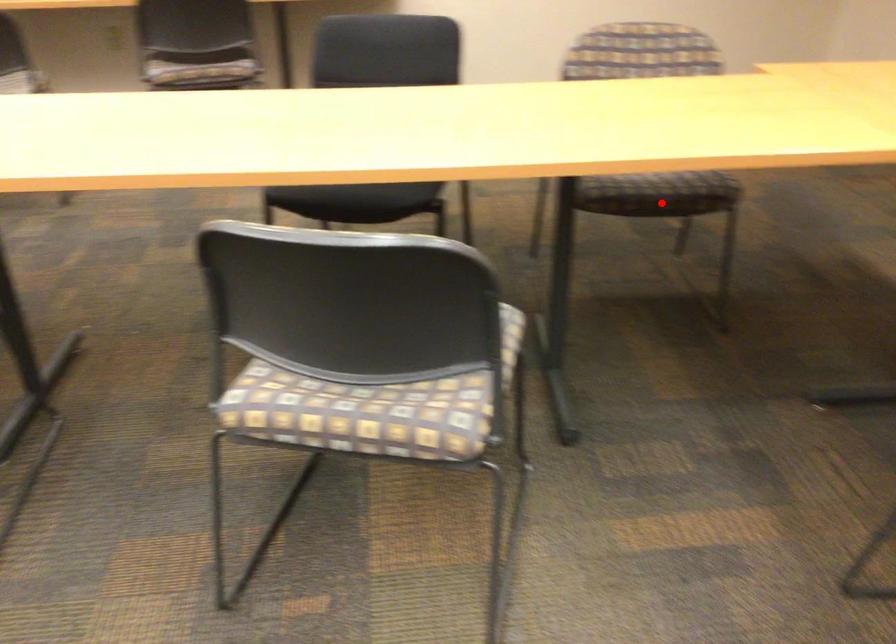
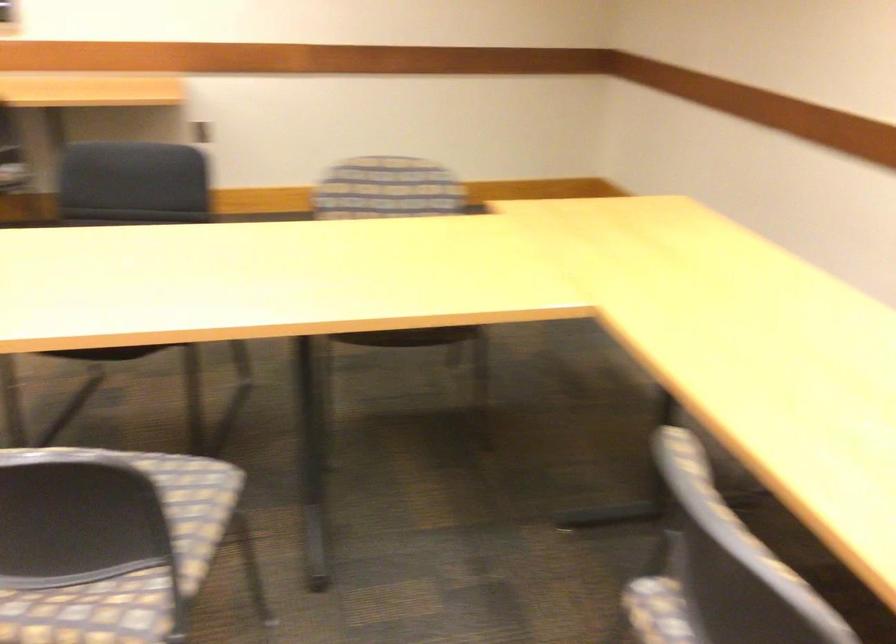
Find the pixel in the second image that matches the highlighted location in the first image.

(410, 337)